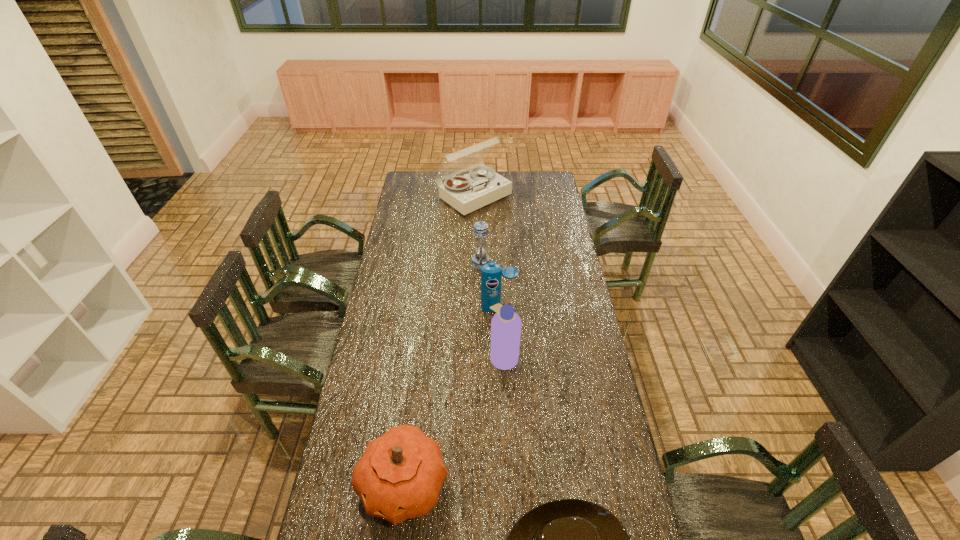
Find the location of a particular element. The width and height of the screenshot is (960, 540). object that is the third closest to the nearer shampoo is located at coordinates (480, 247).

Identify the location of vacant position in the image that satisfies the following two spatial constraints: 1. on the front-facing side of the lantern; 2. on the right side of the third nearest object. Image resolution: width=960 pixels, height=540 pixels. (481, 357).

Where is `vacant space that satisfies the following two spatial constraints: 1. on the front-facing side of the second farthest object; 2. on the right side of the farther shampoo`? vacant space that satisfies the following two spatial constraints: 1. on the front-facing side of the second farthest object; 2. on the right side of the farther shampoo is located at coordinates (481, 308).

Find the location of a particular element. This screenshot has height=540, width=960. free space that satisfies the following two spatial constraints: 1. on the front-facing side of the lantern; 2. on the back side of the nearer shampoo is located at coordinates (481, 357).